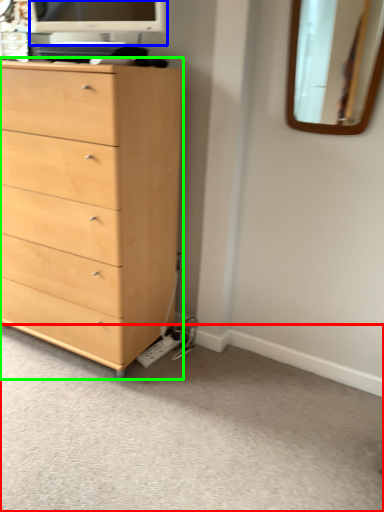
Question: Considering the real-world distances, which object is farthest from plain (highlighted by a red box)? computer monitor (highlighted by a blue box) or chest of drawers (highlighted by a green box)?

Choices:
 (A) computer monitor
 (B) chest of drawers

Answer: (A)